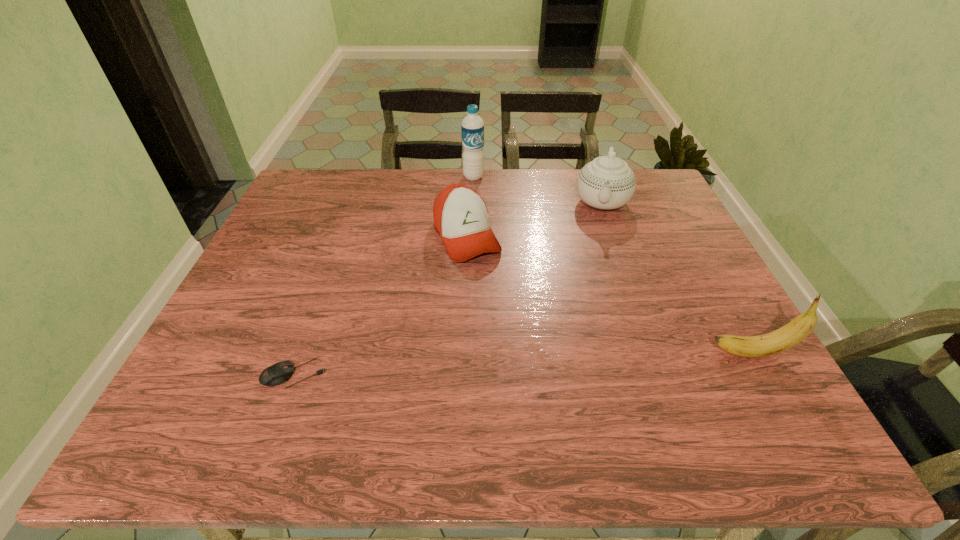
This screenshot has width=960, height=540. I want to click on vacant region at the far edge of the desktop, so click(x=421, y=201).

I want to click on free space at the near edge, so click(x=686, y=389).

The image size is (960, 540). What are the coordinates of `vacant area at the left edge` in the screenshot? It's located at (240, 320).

This screenshot has height=540, width=960. I want to click on vacant space at the right edge of the desktop, so click(722, 293).

Find the location of a particular element. This screenshot has height=540, width=960. free space at the far left corner of the desktop is located at coordinates (350, 170).

The width and height of the screenshot is (960, 540). Find the location of `free space at the far right corner`. free space at the far right corner is located at coordinates (641, 183).

Where is `free point between the mouse and the rightmost object`? The image size is (960, 540). free point between the mouse and the rightmost object is located at coordinates (523, 363).

At what (x,y) coordinates should I click in order to perform the action: click on unoccupied area between the mouse and the rightmost object. Please return your answer as a coordinate pair (x, y). Looking at the image, I should click on (523, 363).

You are a GUI agent. You are given a task and a screenshot of the screen. Output one action in this format:
    pyautogui.click(x=<x>, y=<y>)
    Task: Click on the free space that is in between the fourth tallest object and the shortest object
    
    Given the screenshot: What is the action you would take?
    pyautogui.click(x=380, y=305)

Where is `vacant area between the baseball cap and the shortest object`? This screenshot has height=540, width=960. vacant area between the baseball cap and the shortest object is located at coordinates (380, 305).